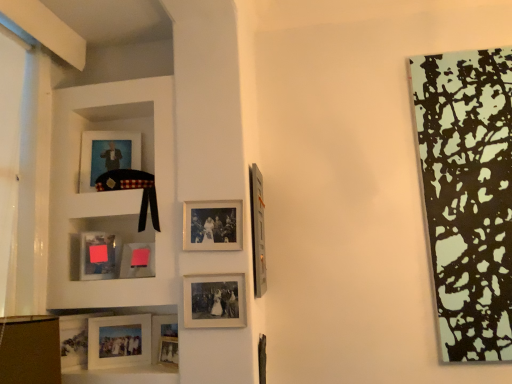
Question: From their relative heights in the image, would you say matte glass picture frame at lower left, the 8th picture frame in the right-to-left sequence, is taller or shorter than matte silver picture frame at lower center, the fourth picture frame viewed from the right?

Choices:
 (A) short
 (B) tall

Answer: (B)

Question: Is matte glass picture frame at lower left, which ranks as the 3th picture frame in left-to-right order, bigger or smaller than matte silver picture frame at lower center, arranged as the 7th picture frame when viewed from the left?

Choices:
 (A) big
 (B) small

Answer: (A)

Question: Estimate the real-world distances between objects in this image. Which object is farther from the matte black picture frame at upper left, arranged as the second picture frame when viewed from the left?

Choices:
 (A) matte silver picture frame at lower left, acting as the tenth picture frame starting from the right
 (B) pink matte picture frame at lower center, acting as the 5th picture frame starting from the left
 (C) brown fabric at lower left, which appears as the second shelf when viewed from the back
 (D) metallic silver picture frame at upper right, the first picture frame from the right
 (E) matte silver picture frame at lower center, placed as the 4th picture frame when sorted from left to right

Answer: (C)

Question: Based on their relative distances, which object is farther from the pink matte picture frame at lower center, positioned as the sixth picture frame in right-to-left order?

Choices:
 (A) matte silver picture frame at lower left, acting as the tenth picture frame starting from the right
 (B) matte black picture frame at upper left, arranged as the second picture frame when viewed from the left
 (C) matte glass picture frame at lower left, which ranks as the 3th picture frame in left-to-right order
 (D) matte silver picture frame at lower center, arranged as the 7th picture frame when viewed from the left
 (E) matte silver picture frame at center, the 2th picture frame in the right-to-left sequence

Answer: (B)